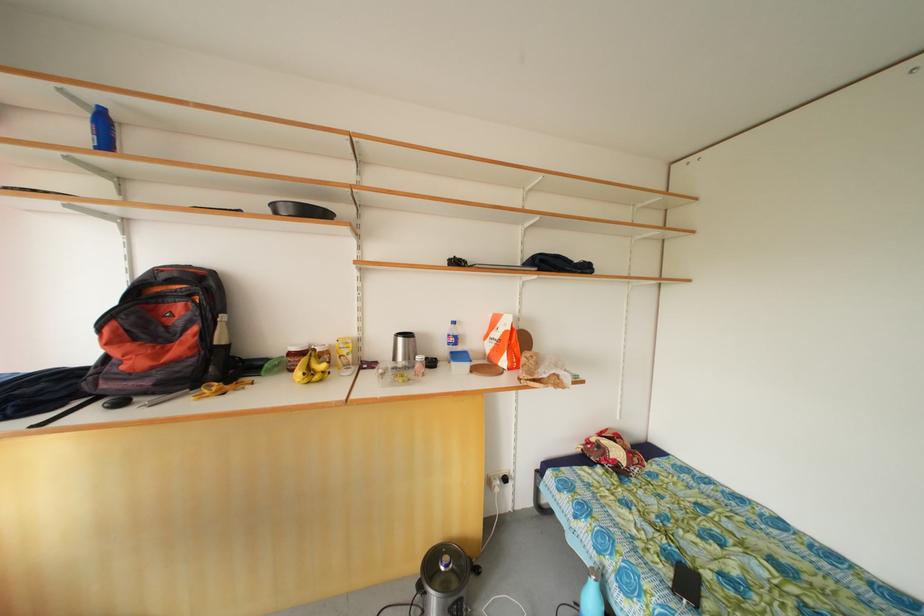
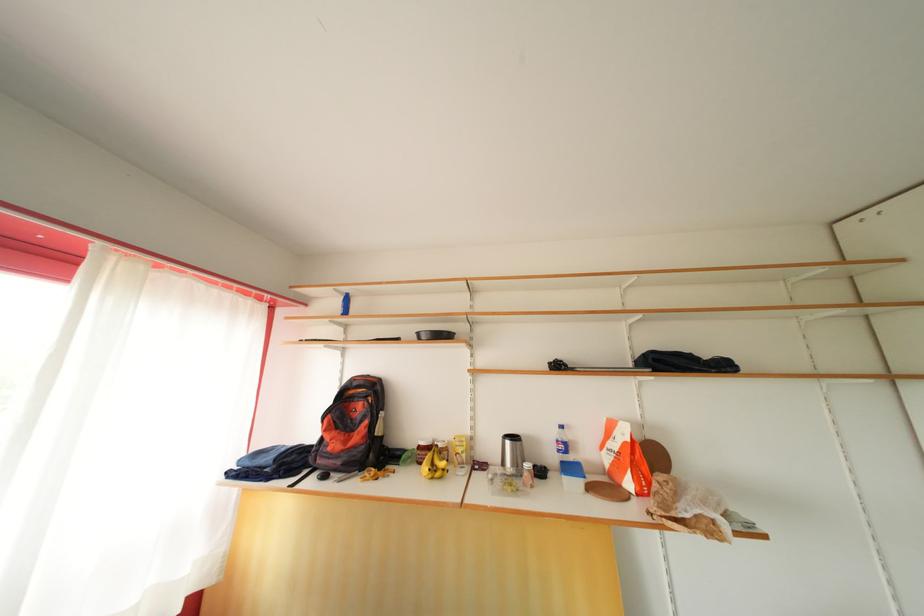
First-person continuous shooting, in which direction is the camera rotating?

The rotation direction of the camera is left-up.